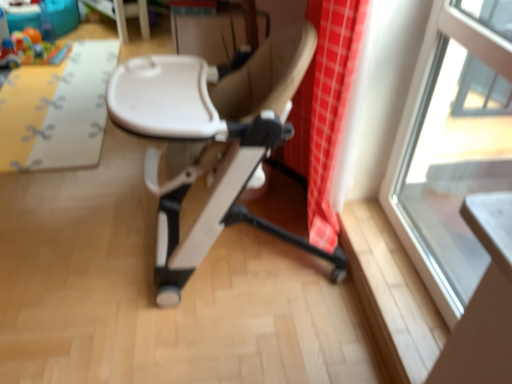
Question: Does beige leather chair at center have a greater height compared to white glossy table at upper center?

Choices:
 (A) yes
 (B) no

Answer: (A)

Question: Is beige leather chair at center positioned with its back to white glossy table at upper center?

Choices:
 (A) no
 (B) yes

Answer: (A)

Question: Is beige leather chair at center thinner than white glossy table at upper center?

Choices:
 (A) no
 (B) yes

Answer: (A)

Question: Is the position of beige leather chair at center less distant than that of white glossy table at upper center?

Choices:
 (A) yes
 (B) no

Answer: (A)

Question: Is beige leather chair at center outside of white glossy table at upper center?

Choices:
 (A) no
 (B) yes

Answer: (B)

Question: Considering the relative sizes of beige leather chair at center and white glossy table at upper center in the image provided, is beige leather chair at center bigger than white glossy table at upper center?

Choices:
 (A) yes
 (B) no

Answer: (A)

Question: Is white glossy table at upper center in contact with yellow fabric mat at upper left?

Choices:
 (A) no
 (B) yes

Answer: (A)

Question: Is white glossy table at upper center shorter than yellow fabric mat at upper left?

Choices:
 (A) yes
 (B) no

Answer: (B)

Question: Does white glossy table at upper center have a lesser width compared to yellow fabric mat at upper left?

Choices:
 (A) no
 (B) yes

Answer: (B)

Question: Does white glossy table at upper center come in front of yellow fabric mat at upper left?

Choices:
 (A) yes
 (B) no

Answer: (B)

Question: Is white glossy table at upper center smaller than yellow fabric mat at upper left?

Choices:
 (A) yes
 (B) no

Answer: (A)

Question: Is white glossy table at upper center oriented towards yellow fabric mat at upper left?

Choices:
 (A) yes
 (B) no

Answer: (B)

Question: Does white glossy table at upper center contain beige leather chair at center?

Choices:
 (A) no
 (B) yes

Answer: (A)